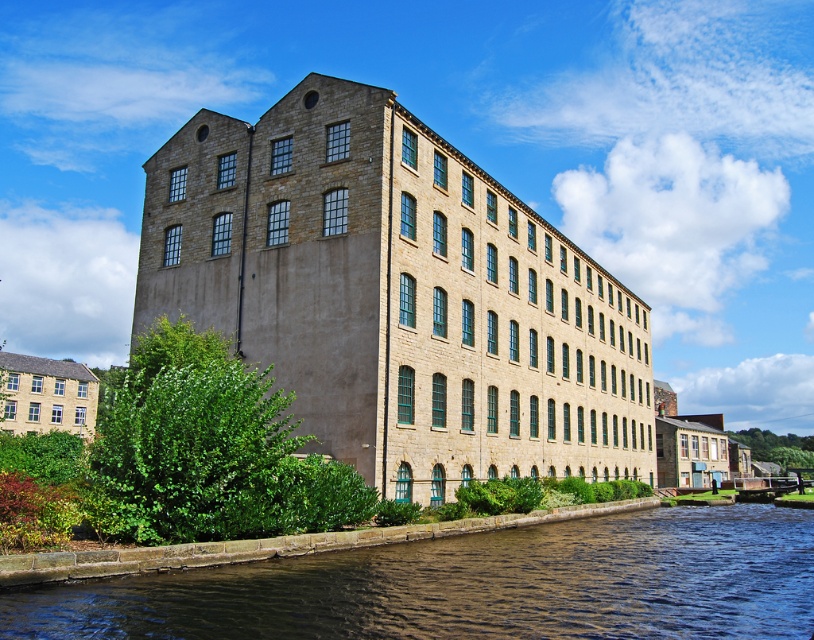
Who is higher up, beige stone building at center or brown water at lower center?

Positioned higher is beige stone building at center.

Which is behind, point (628, 324) or point (11, 588)?

The point (628, 324) is behind.

The height and width of the screenshot is (640, 814). I want to click on beige stone building at center, so click(396, 296).

Locate an element on the screen. beige stone building at center is located at coordinates (396, 296).